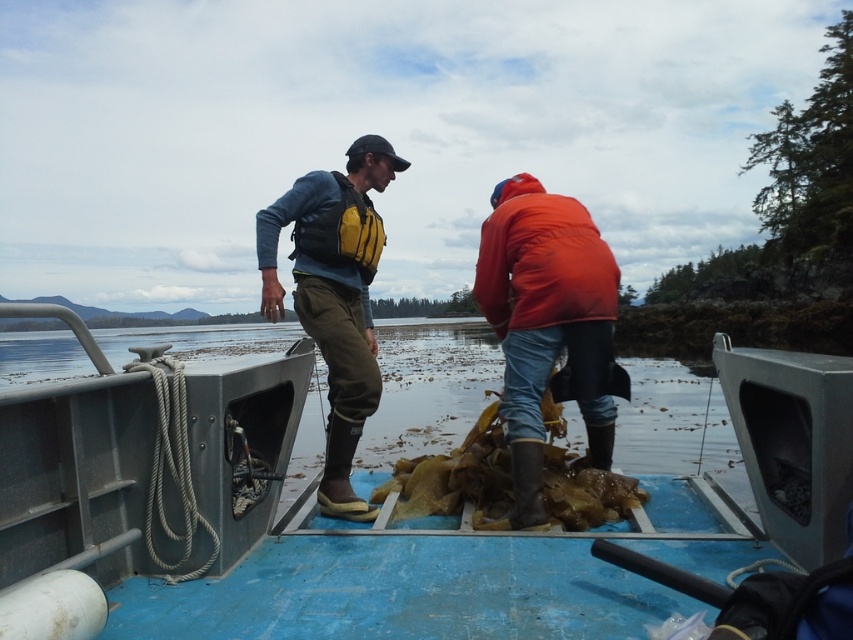
Find the location of `metallic blue boat at center`. metallic blue boat at center is located at coordinates (212, 515).

Between point (296, 368) and point (637, 461), which one is positioned behind?

Positioned behind is point (637, 461).

Which is in front, point (231, 499) or point (55, 333)?

Positioned in front is point (231, 499).

What are the coordinates of `metallic blue boat at center` in the screenshot? It's located at (212, 515).

Does metallic blue boat at center have a lesser width compared to matte yellow life vest at center?

No, metallic blue boat at center is not thinner than matte yellow life vest at center.

Locate an element on the screen. The height and width of the screenshot is (640, 853). metallic blue boat at center is located at coordinates (212, 515).

Where is `clear water at center`? The image size is (853, 640). clear water at center is located at coordinates (428, 387).

Which is in front, point (32, 333) or point (561, 269)?

Point (561, 269)

Between point (222, 355) and point (537, 186), which one is positioned behind?

The point (222, 355) is more distant.

Locate an element on the screen. This screenshot has height=640, width=853. clear water at center is located at coordinates (428, 387).